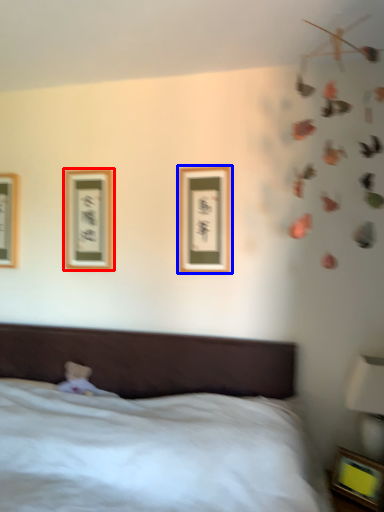
Question: Which object appears farthest to the camera in this image, picture frame (highlighted by a red box) or picture frame (highlighted by a blue box)?

Choices:
 (A) picture frame
 (B) picture frame

Answer: (A)